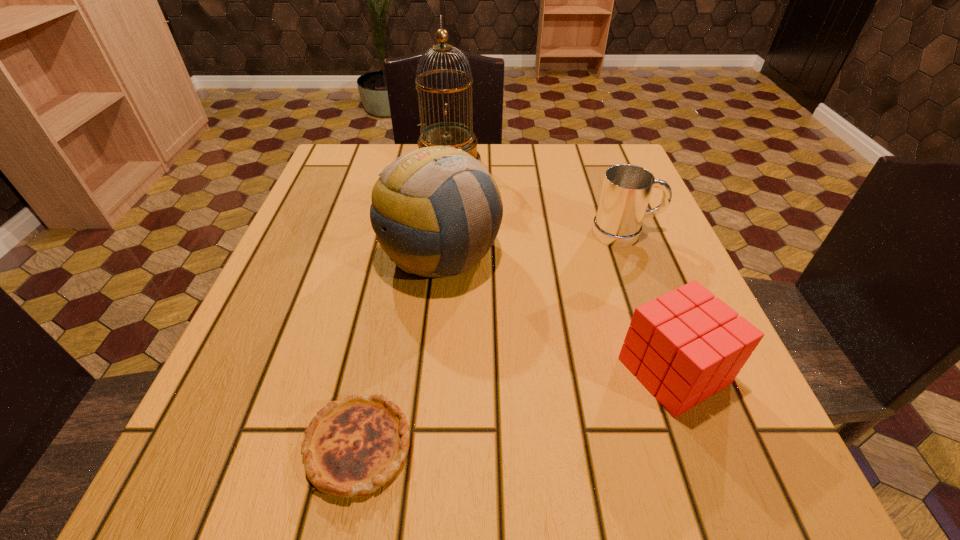
Point out which object is positioned as the third nearest to the second tallest object. Please provide its 2D coordinates. Your answer should be formatted as a tuple, i.e. [(x, y)], where the tuple contains the x and y coordinates of a point satisfying the conditions above.

[(626, 191)]

Select which object appears as the third closest to the volleyball. Please provide its 2D coordinates. Your answer should be formatted as a tuple, i.e. [(x, y)], where the tuple contains the x and y coordinates of a point satisfying the conditions above.

[(626, 191)]

Find the location of a particular element. The height and width of the screenshot is (540, 960). free space that satisfies the following two spatial constraints: 1. with an open door on the birdcage; 2. on the back side of the volleyball is located at coordinates (440, 255).

Identify the location of free space that satisfies the following two spatial constraints: 1. with an open door on the volleyball; 2. on the left side of the farthest object. (440, 255).

Find the location of a particular element. free space in the image that satisfies the following two spatial constraints: 1. with an open door on the tallest object; 2. on the left side of the cube is located at coordinates (428, 371).

Locate an element on the screen. The width and height of the screenshot is (960, 540). vacant space that satisfies the following two spatial constraints: 1. on the back side of the cube; 2. on the left side of the shortest object is located at coordinates (374, 371).